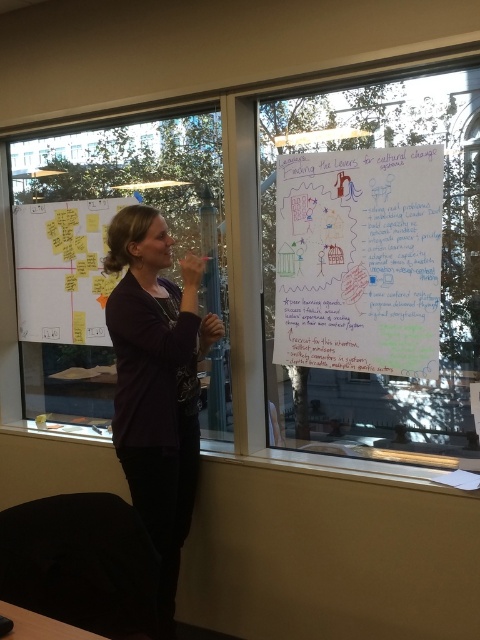
You are an architect designing a new office space and need to place two markers on a blueprint. The first marker must be placed at point (57, 212) and the second at point (288, 157). According to the scene, which point is closer to the front of the room?

Point (288, 157) is closer to the front of the room because it is in front of point (57, 212), which is behind it.